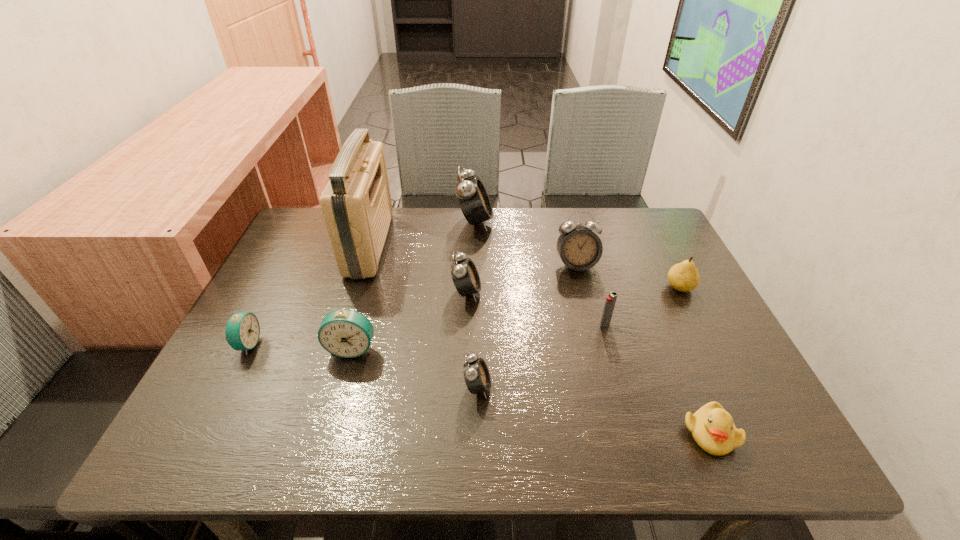
This screenshot has height=540, width=960. Find the location of `pear present at the right edge`. pear present at the right edge is located at coordinates (684, 276).

I want to click on duckling at the right edge, so click(713, 429).

What are the coordinates of `object located at the near right corner` in the screenshot? It's located at (713, 429).

I want to click on vacant space at the far edge of the desktop, so click(574, 213).

In the image, there is a desktop. Identify the location of blank space at the near edge. The height and width of the screenshot is (540, 960). (585, 429).

You are a GUI agent. You are given a task and a screenshot of the screen. Output one action in this format:
    pyautogui.click(x=<x>, y=<y>)
    Task: Click on the vacant area at the left edge of the desktop
    
    Given the screenshot: What is the action you would take?
    pyautogui.click(x=276, y=400)

In the image, there is a desktop. Where is `free region at the right edge`? free region at the right edge is located at coordinates (658, 293).

Identify the location of vacant region at the near left corner of the desktop. The height and width of the screenshot is (540, 960). (183, 438).

The image size is (960, 540). In the image, there is a desktop. In order to click on blank space at the far right corner in this screenshot , I will do `click(654, 247)`.

Image resolution: width=960 pixels, height=540 pixels. I want to click on free space between the nearest white alarm clock and the smaller blue alarm clock, so click(362, 366).